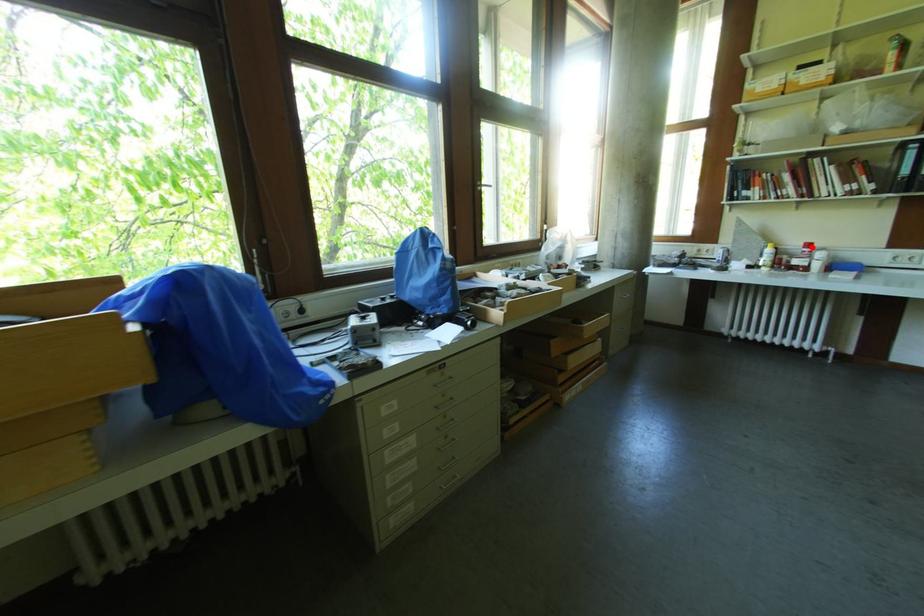
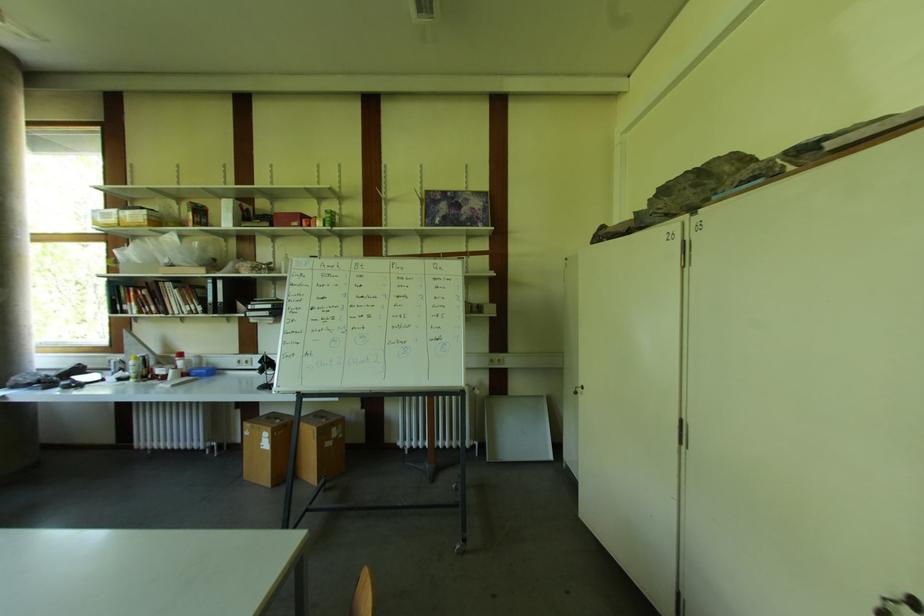
Find the pixel in the second image that matches the highlighted location in the first image.

(184, 357)